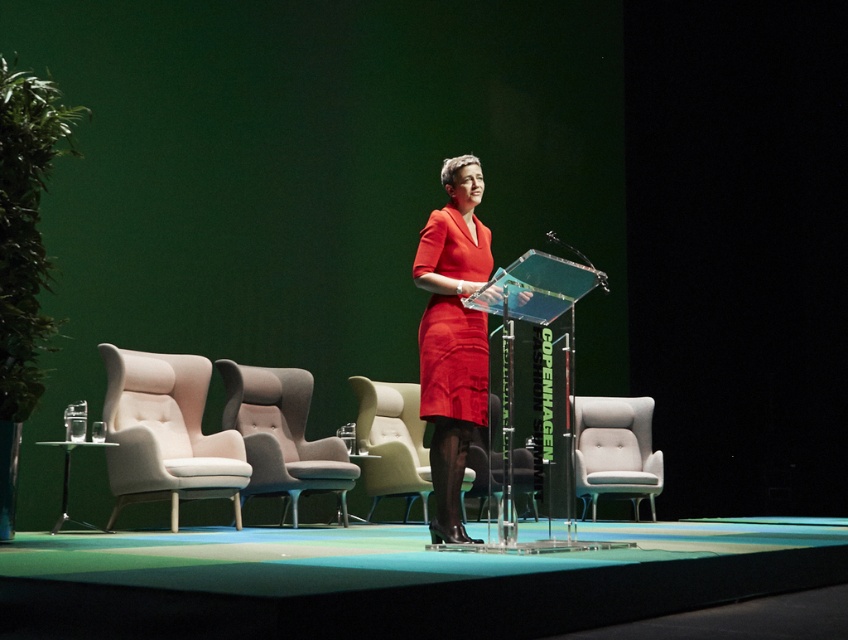
You are an event photographer positioned at the back of the stage. You need to capture a close shot of the light gray fabric wingback chair at center. Given that your camera has a maximum zoom range of 10 meters, will you be able to focus on the chair from your current position?

The light gray fabric wingback chair at center is 8.32 meters away from the viewer. Since your camera can zoom up to 10 meters, you can focus on the chair from your current position as the distance is within the camera range.

You are an event planner trying to arrange seating for a small panel discussion. You have two chairs available on stage, the light gray fabric wingback chair at center and the matte beige chair at center. If you need to place a rectangular table between them, which chair should you position closer to the table to ensure there is enough space for people to walk behind it?

The matte beige chair at center should be positioned closer to the table because the light gray fabric wingback chair at center might be wider, requiring more space behind it for comfortable passage.